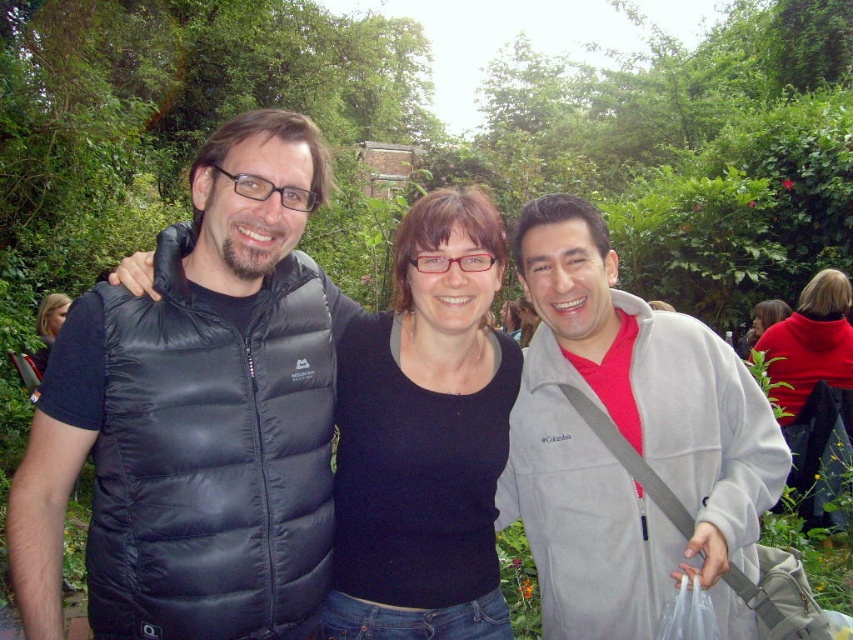
You are an observer standing in front of the three people in the garden. You notice the gray fleece jacket at center and the black matte sweater at center. Which one is positioned lower on the person?

The gray fleece jacket at center is located below the black matte sweater at center, so it is positioned lower on the person.

You are a photographer trying to capture a photo of the gray fleece jacket at center. The camera you are using has a focal point at coordinates 0.691, 0.737. Will the jacket be in focus?

The gray fleece jacket at center is located at point [628,442], so yes, the jacket will be in focus since the camera focal point matches its location.

You are standing at the gray fleece jacket at center and want to toss a ball to the matte red sweater at right. Given that the minimum throwing distance required is 3 meters, will you be able to reach them?

The gray fleece jacket at center is 3.64 meters away from the matte red sweater at right, so yes, you can reach them as the distance is greater than the minimum required 3 meters.